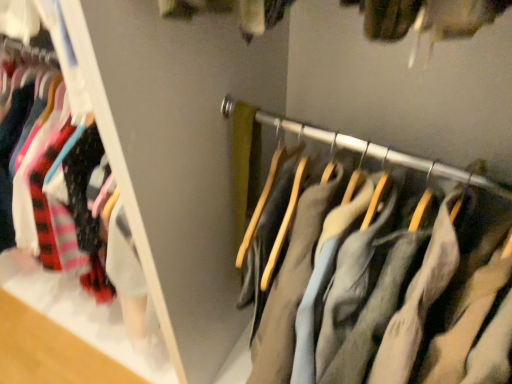
Question: From a real-world perspective, is light gray cotton pants at center located beneath matte black hangers at left?

Choices:
 (A) no
 (B) yes

Answer: (B)

Question: Is light gray cotton pants at center not close to matte black hangers at left?

Choices:
 (A) no
 (B) yes

Answer: (A)

Question: Is light gray cotton pants at center aimed at matte black hangers at left?

Choices:
 (A) no
 (B) yes

Answer: (A)

Question: Is light gray cotton pants at center facing away from matte black hangers at left?

Choices:
 (A) no
 (B) yes

Answer: (A)

Question: Considering the relative sizes of light gray cotton pants at center and matte black hangers at left in the image provided, is light gray cotton pants at center shorter than matte black hangers at left?

Choices:
 (A) yes
 (B) no

Answer: (A)

Question: Does light gray cotton pants at center lie in front of matte black hangers at left?

Choices:
 (A) no
 (B) yes

Answer: (B)

Question: Does matte black hangers at left appear on the left side of light gray cotton pants at center?

Choices:
 (A) yes
 (B) no

Answer: (A)

Question: Is matte black hangers at left to the right of light gray cotton pants at center from the viewer's perspective?

Choices:
 (A) no
 (B) yes

Answer: (A)

Question: From a real-world perspective, is matte black hangers at left physically below light gray cotton pants at center?

Choices:
 (A) no
 (B) yes

Answer: (A)

Question: Is the depth of matte black hangers at left less than that of light gray cotton pants at center?

Choices:
 (A) no
 (B) yes

Answer: (A)

Question: Is matte black hangers at left oriented towards light gray cotton pants at center?

Choices:
 (A) no
 (B) yes

Answer: (A)

Question: Is matte black hangers at left turned away from light gray cotton pants at center?

Choices:
 (A) yes
 (B) no

Answer: (B)

Question: Considering the positions of point (138, 347) and point (462, 264), is point (138, 347) closer or farther from the camera than point (462, 264)?

Choices:
 (A) closer
 (B) farther

Answer: (B)